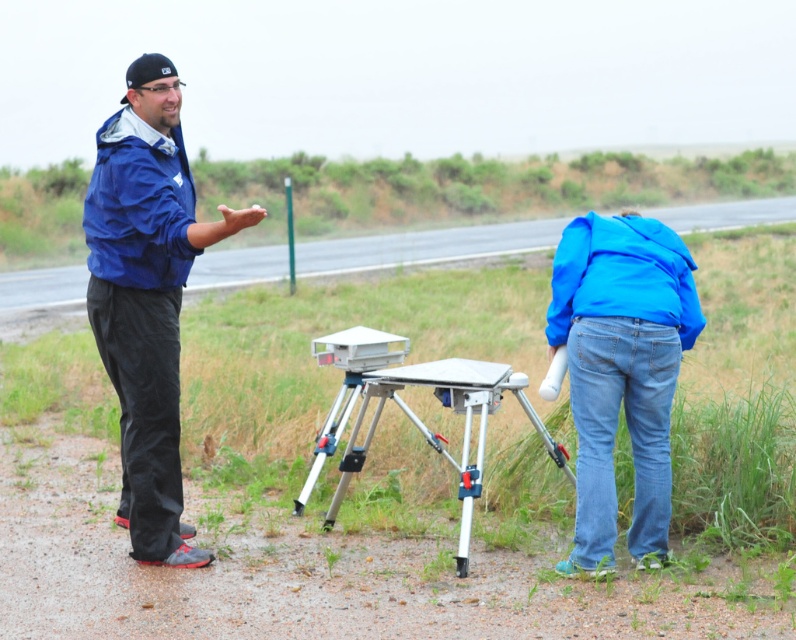
You are a photographer trying to capture a clear shot of the silver metallic tripod at center without the blue denim jeans at lower right blocking the view. Based on their positions, can you position yourself in a way to avoid the jeans from obstructing the tripod?

The blue denim jeans at lower right is located above the silver metallic tripod at center, so positioning yourself lower or adjusting your angle to look upwards might allow you to capture the tripod without the jeans blocking the view.

You are a photographer standing at the origin point. You need to take a photo of the blue matte jacket at left. What are the coordinates where you should aim your camera?

The coordinates to aim your camera are at point (146, 296).

You are a photographer trying to capture a candid shot of the person in the blue matte jacket at left without them noticing. You are currently positioned at point (146,296). Can you take the photo from this position?

The point (146,296) is on the blue matte jacket at left, so you cannot take the photo from this position as it would be on the jacket itself.